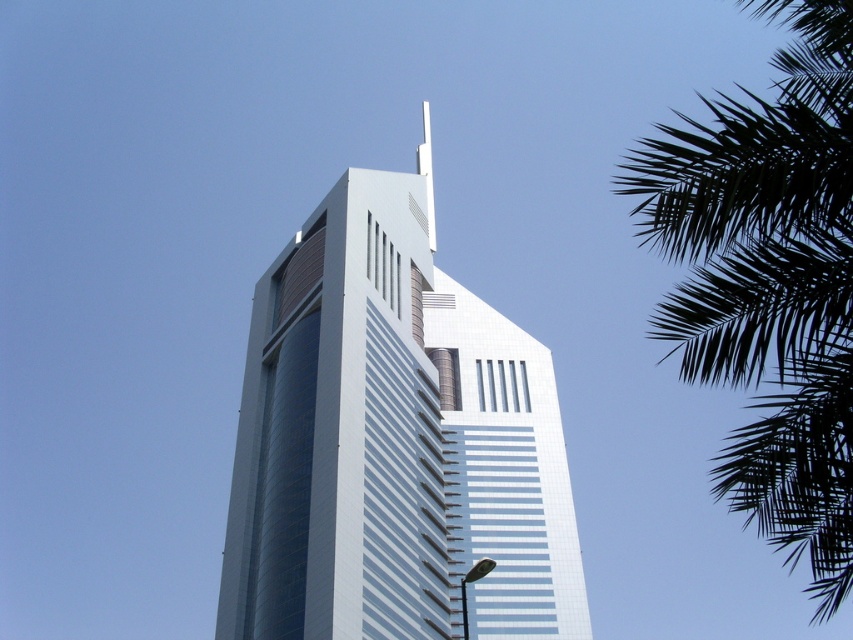
Does white glass building at center appear on the left side of green leafy palm at upper right?

Yes, white glass building at center is to the left of green leafy palm at upper right.

Can you confirm if white glass building at center is taller than green leafy palm at upper right?

In fact, white glass building at center may be shorter than green leafy palm at upper right.

Does point (283, 284) lie behind point (683, 340)?

That is True.

I want to click on white glass building at center, so click(393, 442).